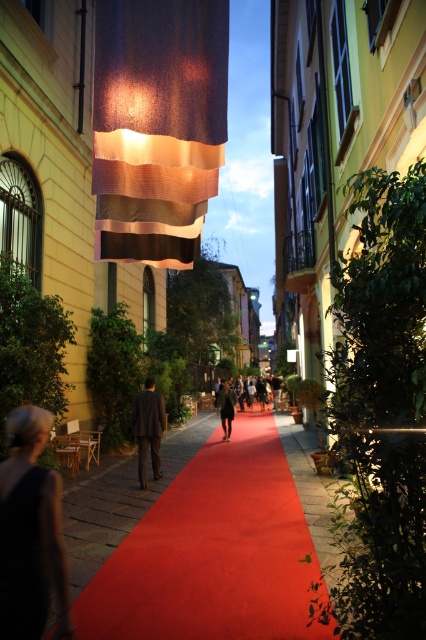
Question: Which object is closer to the camera taking this photo?

Choices:
 (A) dark brown suit at center
 (B) brown leather jacket at center

Answer: (A)

Question: Which of the following is the closest to the observer?

Choices:
 (A) smooth red carpet at center
 (B) brown leather jacket at center
 (C) black fabric dress at lower left

Answer: (C)

Question: Is black fabric dress at lower left to the left of dark brown suit at center from the viewer's perspective?

Choices:
 (A) yes
 (B) no

Answer: (B)

Question: Among these points, which one is farthest from the camera?

Choices:
 (A) (20, 460)
 (B) (230, 408)
 (C) (124, 566)
 (D) (158, 404)

Answer: (B)

Question: From the image, what is the correct spatial relationship of dark brown suit at center in relation to brown leather jacket at center?

Choices:
 (A) right
 (B) left

Answer: (B)

Question: Can you confirm if black fabric dress at lower left is smaller than brown leather jacket at center?

Choices:
 (A) yes
 (B) no

Answer: (A)